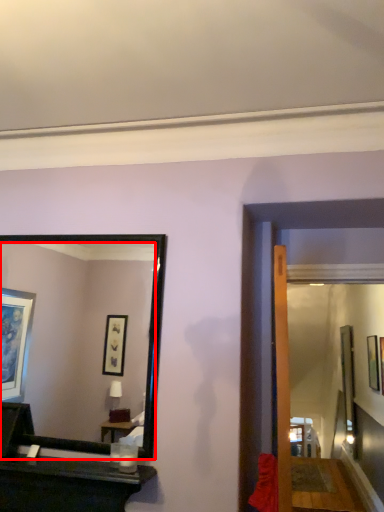
Question: From the image's perspective, where is mirror (annotated by the red box) located relative to picture frame?

Choices:
 (A) above
 (B) below

Answer: (A)